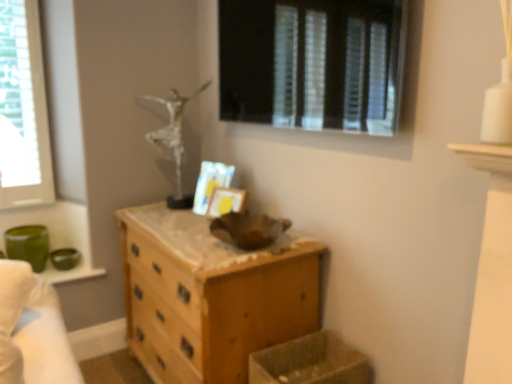
Question: Is point (358, 24) positioned closer to the camera than point (249, 369)?

Choices:
 (A) farther
 (B) closer

Answer: (B)

Question: In the image, is transparent glass window at upper center, the second window in the back-to-front sequence, positioned in front of or behind translucent plastic crate at lower center?

Choices:
 (A) behind
 (B) front

Answer: (B)

Question: Which object is positioned closest to the green fabric bed at left?

Choices:
 (A) wooden picture frame at center
 (B) translucent plastic crate at lower center
 (C) transparent glass window at upper center, the 1th window when ordered from right to left
 (D) clear glass window at left, which appears as the second window when viewed from the right
 (E) wooden chest of drawers at center

Answer: (E)

Question: Which object is positioned closest to the green fabric bed at left?

Choices:
 (A) translucent plastic crate at lower center
 (B) clear glass window at left, which appears as the 2th window when viewed from the front
 (C) transparent glass window at upper center, the second window in the back-to-front sequence
 (D) wooden chest of drawers at center
 (E) wooden picture frame at center

Answer: (D)